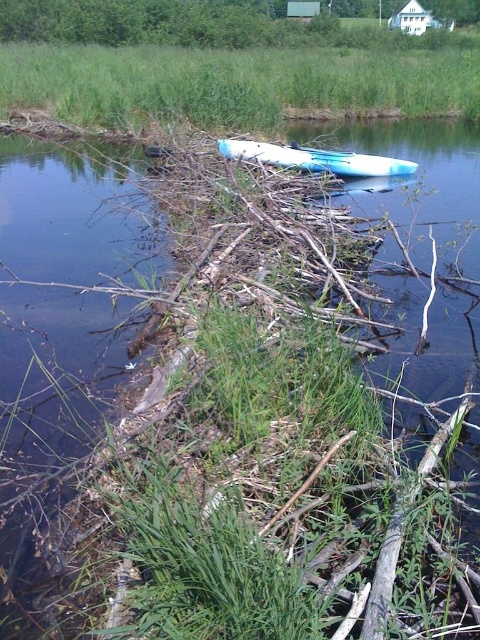
Question: Observing the image, what is the correct spatial positioning of green grass at center in reference to blue glossy kayak at center?

Choices:
 (A) below
 (B) above

Answer: (B)

Question: Which object is closer to the camera taking this photo?

Choices:
 (A) green grass at center
 (B) blue glossy kayak at center

Answer: (B)

Question: Among these objects, which one is nearest to the camera?

Choices:
 (A) blue glossy kayak at center
 (B) green grass at center

Answer: (A)

Question: Is green grass at center thinner than blue glossy kayak at center?

Choices:
 (A) no
 (B) yes

Answer: (A)

Question: Does green grass at center appear on the left side of blue glossy kayak at center?

Choices:
 (A) no
 (B) yes

Answer: (B)

Question: Which point is farther to the camera?

Choices:
 (A) (210, 116)
 (B) (263, 150)

Answer: (A)